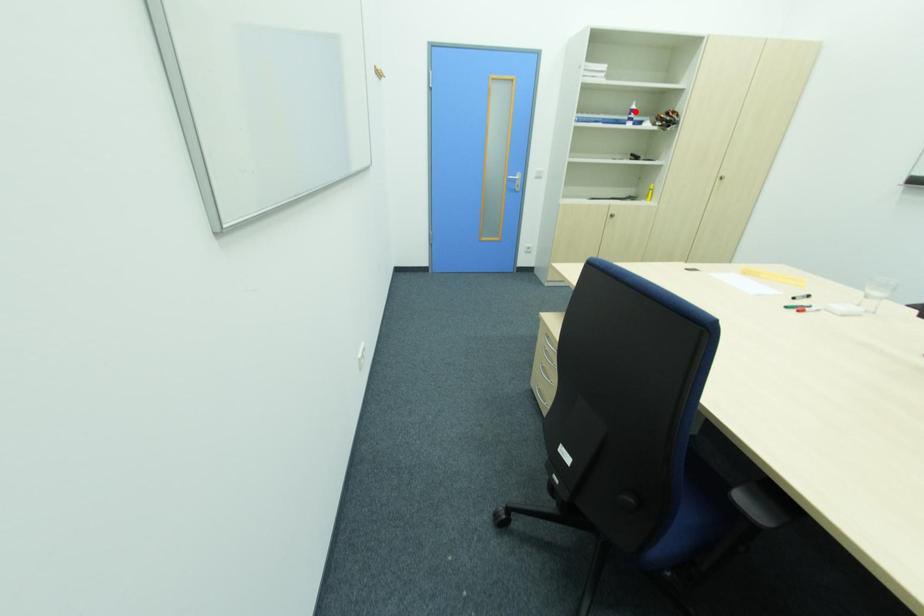
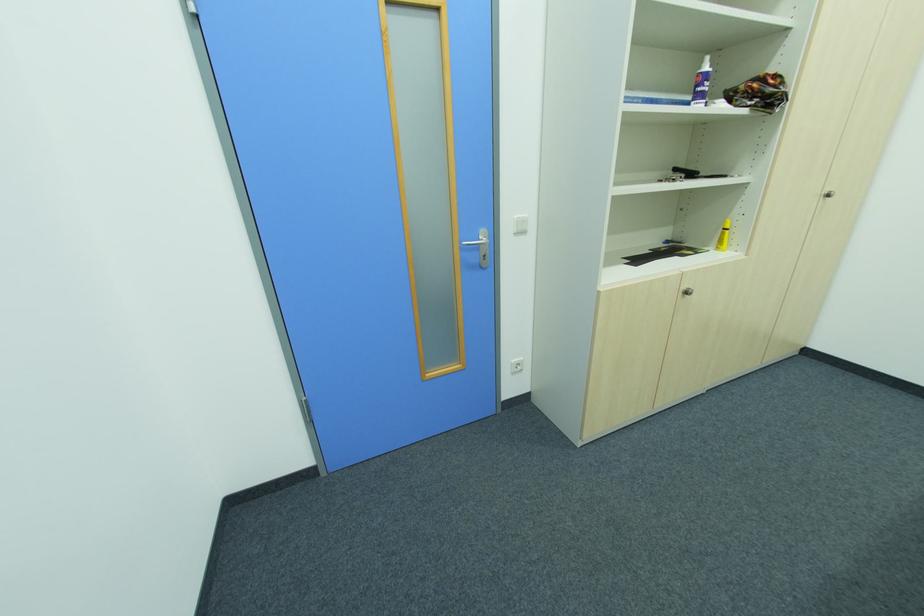
Where in the second image is the point corresponding to the highlighted location from the first image?

(708, 78)